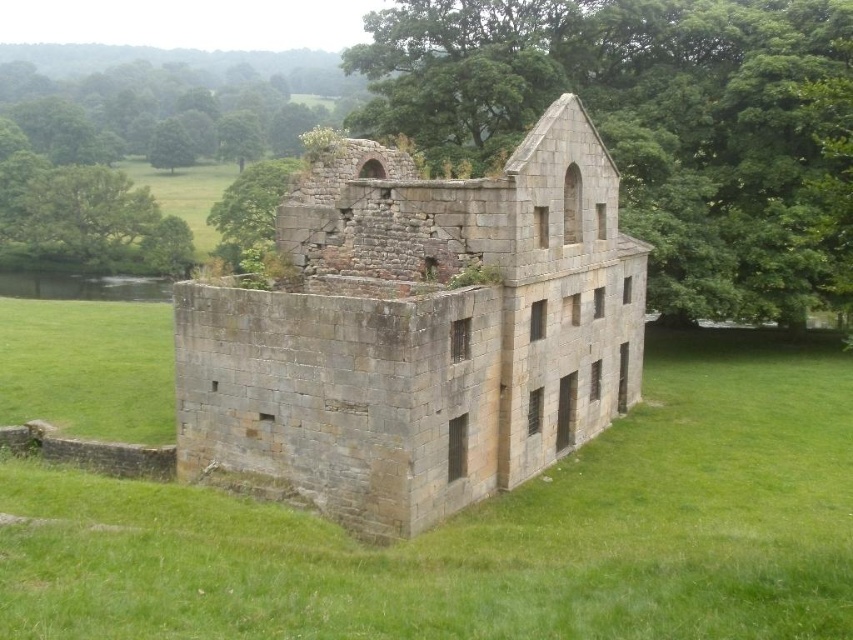
You are standing in front of the old stone building and want to determine which of the two points, point (752, 465) or point (521, 93), is nearer to you. Based on the scene description, which point is closer?

Point (752, 465) is closer to the viewer than point (521, 93).

You are an architect examining the image of an old stone building. You notice the gray stone castle at center and the green leafy tree at upper left. Which of these two objects has a narrower width in the image?

The gray stone castle at center is thinner than green leafy tree at upper left, so the gray stone castle at center has a narrower width.

You are a drone operator who needs to fly a drone from the green grass at center to the green leafy tree at upper left. The drone has a maximum flight range of 60 meters. Can the drone reach the tree without needing to recharge?

The green grass at center and green leafy tree at upper left are 65.51 meters apart from each other, so the drone cannot reach the tree without recharging since it exceeds the 60 meters range.